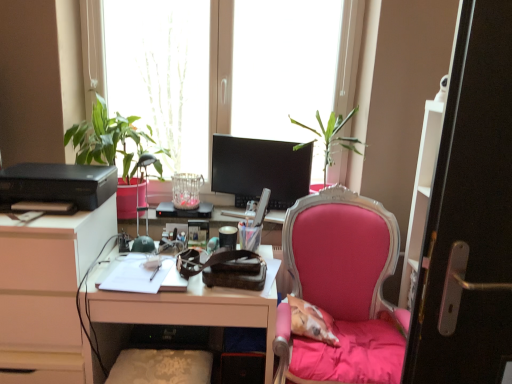
Question: From the image's perspective, relative to transparent glass window at upper center, is pink fabric chair at center above or below?

Choices:
 (A) below
 (B) above

Answer: (A)

Question: Is pink fabric chair at center wider or thinner than transparent glass window at upper center?

Choices:
 (A) wide
 (B) thin

Answer: (A)

Question: Based on their relative distances, which object is farther from the black matte printer at left?

Choices:
 (A) white glossy desk at center
 (B) green matte lamp at left
 (C) white matte cabinet at left
 (D) pink fabric chair at center
 (E) transparent glass window at upper center

Answer: (D)

Question: Which object is positioned farthest from the white glossy desk at center?

Choices:
 (A) black matte printer at left
 (B) white matte cabinet at left
 (C) transparent glass window at upper center
 (D) pink fabric chair at center
 (E) matte black monitor at center

Answer: (C)